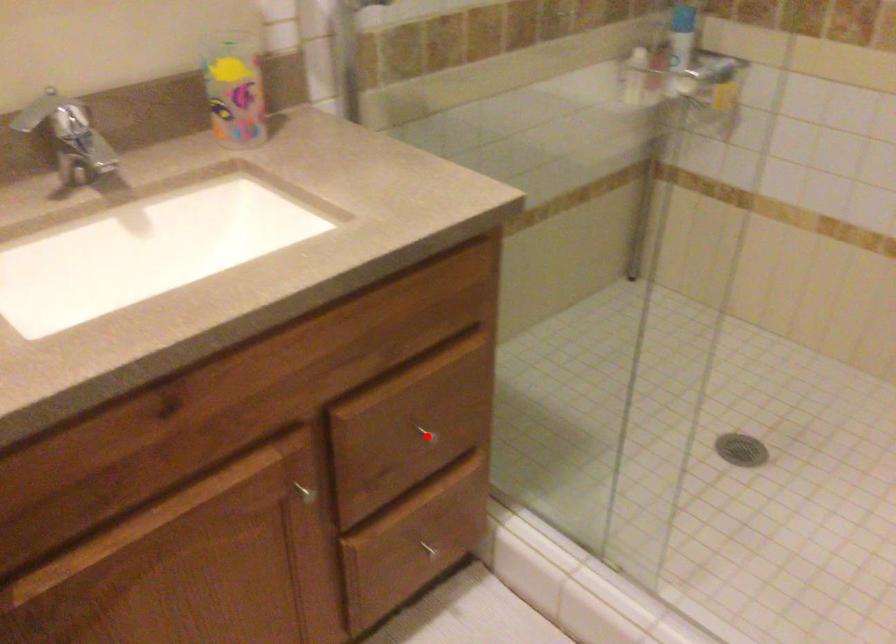
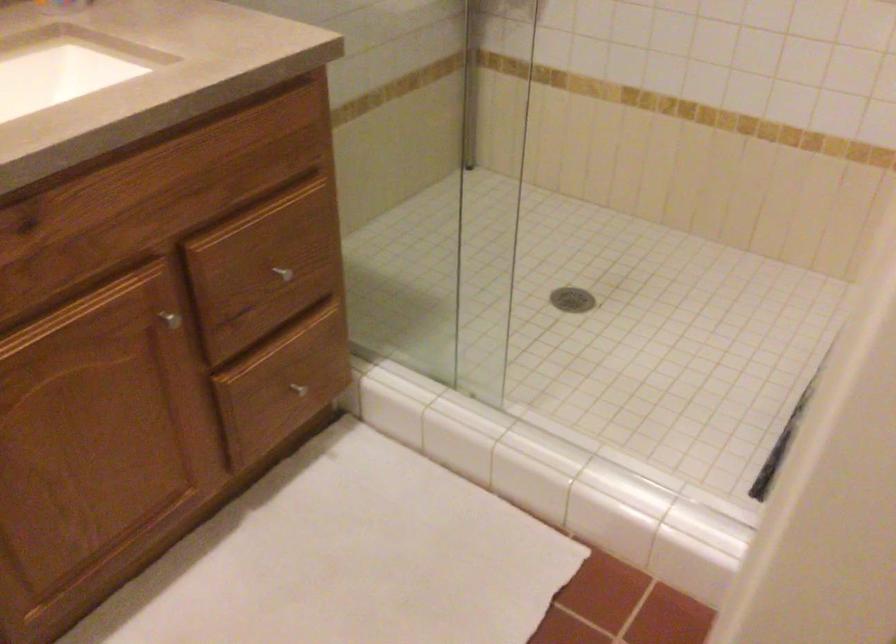
Question: I am providing you with two images of the same scene from different viewpoints. A red point is marked on the first image. At the location where the point appears in image 1, is it still visible in image 2?

Choices:
 (A) Yes
 (B) No

Answer: (A)